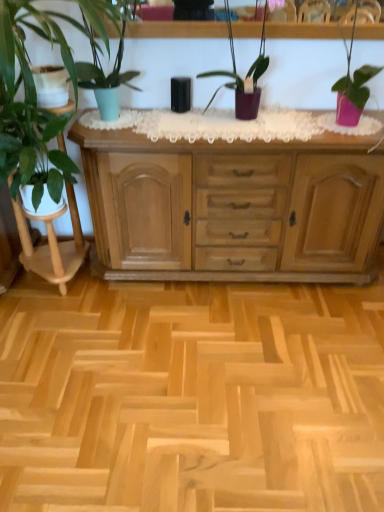
Question: Can you confirm if white glossy plant stand at left is taller than pink matte pot at right, which is counted as the 4th houseplant, starting from the left?

Choices:
 (A) no
 (B) yes

Answer: (B)

Question: Can you confirm if white glossy plant stand at left is positioned to the left of pink matte pot at right, the 1th houseplant viewed from the right?

Choices:
 (A) no
 (B) yes

Answer: (B)

Question: Can you confirm if white glossy plant stand at left is thinner than pink matte pot at right, which is counted as the 4th houseplant, starting from the left?

Choices:
 (A) no
 (B) yes

Answer: (A)

Question: Is white glossy plant stand at left facing towards pink matte pot at right, the 1th houseplant viewed from the right?

Choices:
 (A) yes
 (B) no

Answer: (B)

Question: Is white glossy plant stand at left next to pink matte pot at right, which is counted as the 4th houseplant, starting from the left?

Choices:
 (A) no
 (B) yes

Answer: (A)

Question: Looking at their shapes, would you say natural wood cabinet at center is wider or thinner than pink matte pot at right, which is counted as the 4th houseplant, starting from the left?

Choices:
 (A) wide
 (B) thin

Answer: (A)

Question: Considering the relative positions of natural wood cabinet at center and pink matte pot at right, which is counted as the 4th houseplant, starting from the left, in the image provided, is natural wood cabinet at center to the left or to the right of pink matte pot at right, which is counted as the 4th houseplant, starting from the left,?

Choices:
 (A) left
 (B) right

Answer: (A)

Question: From a real-world perspective, is natural wood cabinet at center positioned above or below pink matte pot at right, the 1th houseplant viewed from the right?

Choices:
 (A) below
 (B) above

Answer: (A)

Question: Is point (152, 228) positioned closer to the camera than point (352, 44)?

Choices:
 (A) farther
 (B) closer

Answer: (A)

Question: From the image's perspective, is white glossy plant stand at left positioned above or below matte green pot at left, the fourth houseplant from the right?

Choices:
 (A) above
 (B) below

Answer: (B)

Question: Visually, is white glossy plant stand at left positioned to the left or to the right of matte green pot at left, marked as the first houseplant in a left-to-right arrangement?

Choices:
 (A) left
 (B) right

Answer: (A)

Question: In terms of height, does white glossy plant stand at left look taller or shorter compared to matte green pot at left, marked as the first houseplant in a left-to-right arrangement?

Choices:
 (A) short
 (B) tall

Answer: (B)

Question: Considering the positions of white glossy plant stand at left and matte green pot at left, marked as the first houseplant in a left-to-right arrangement, in the image, is white glossy plant stand at left wider or thinner than matte green pot at left, marked as the first houseplant in a left-to-right arrangement,?

Choices:
 (A) wide
 (B) thin

Answer: (B)

Question: In the image, is matte green pot at left, the fourth houseplant from the right, positioned in front of or behind natural wood cabinet at center?

Choices:
 (A) front
 (B) behind

Answer: (A)

Question: From the image's perspective, relative to natural wood cabinet at center, is matte green pot at left, the fourth houseplant from the right, above or below?

Choices:
 (A) above
 (B) below

Answer: (A)